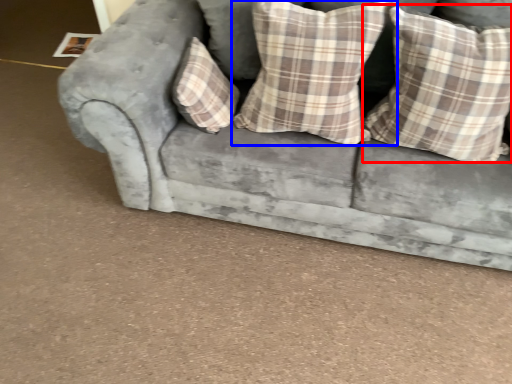
Question: Which point is further to the camera, pillow (highlighted by a red box) or pillow (highlighted by a blue box)?

Choices:
 (A) pillow
 (B) pillow

Answer: (B)